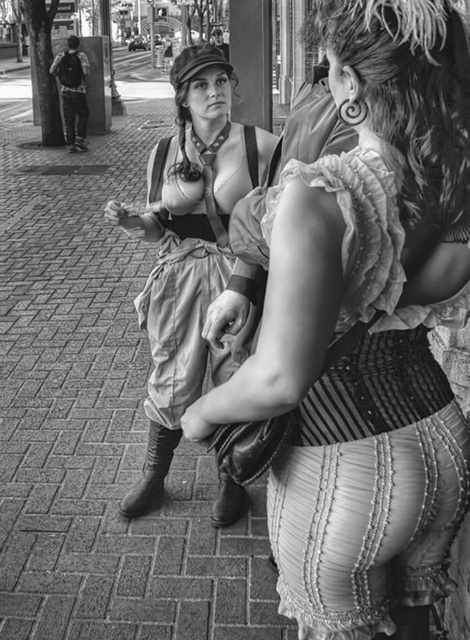
Question: Is ruffled fabric dress at center in front of leather boot at center?

Choices:
 (A) yes
 (B) no

Answer: (A)

Question: Is the position of matte leather purse at center less distant than that of matte leather vest at center?

Choices:
 (A) yes
 (B) no

Answer: (A)

Question: Among these points, which one is nearest to the camera?

Choices:
 (A) (252, 152)
 (B) (232, 477)
 (C) (283, 592)

Answer: (C)

Question: Does matte leather purse at center have a smaller size compared to leather boot at lower left?

Choices:
 (A) no
 (B) yes

Answer: (A)

Question: Which point appears closest to the camera in this image?

Choices:
 (A) (148, 461)
 (B) (391, 451)
 (C) (150, 157)

Answer: (B)

Question: Which of the following is the farthest from the observer?

Choices:
 (A) matte leather purse at center
 (B) leather boot at lower left
 (C) leather boot at center
 (D) ruffled fabric dress at center

Answer: (B)